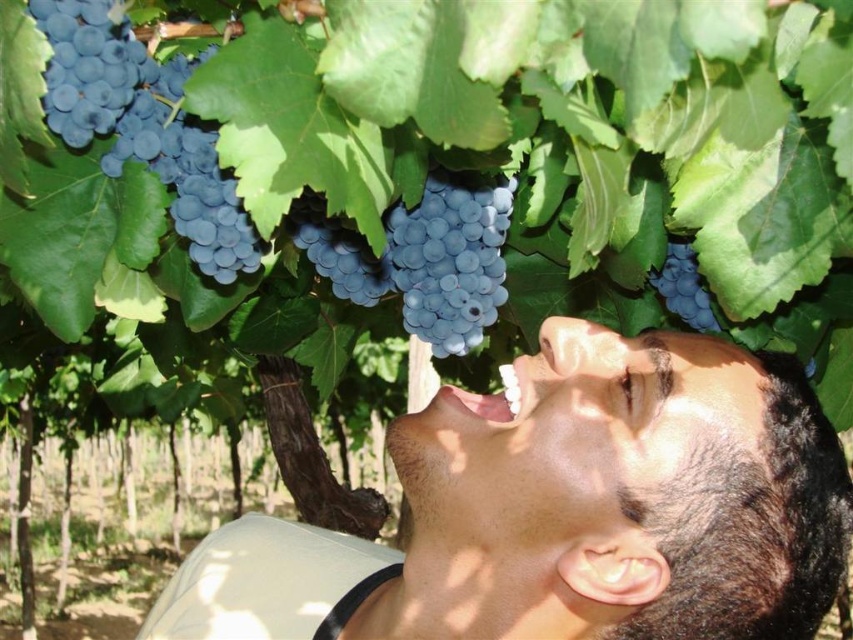
Question: Where is blue matte grape at center located in relation to matte dark blue grape at upper right in the image?

Choices:
 (A) above
 (B) below

Answer: (A)

Question: Which point appears farthest from the camera in this image?

Choices:
 (A) (666, 292)
 (B) (427, 435)

Answer: (A)

Question: Which point is closer to the camera?

Choices:
 (A) (448, 445)
 (B) (662, 288)
 (C) (178, 179)
 (D) (489, 288)

Answer: (A)

Question: Can you confirm if smooth skin face at center is positioned below blue matte grapes at upper left?

Choices:
 (A) yes
 (B) no

Answer: (A)

Question: Which point appears closest to the camera in this image?

Choices:
 (A) (80, 83)
 (B) (701, 305)
 (C) (456, 248)

Answer: (A)

Question: Does blue matte grapes at upper left appear on the right side of blue matte grape at center?

Choices:
 (A) no
 (B) yes

Answer: (A)